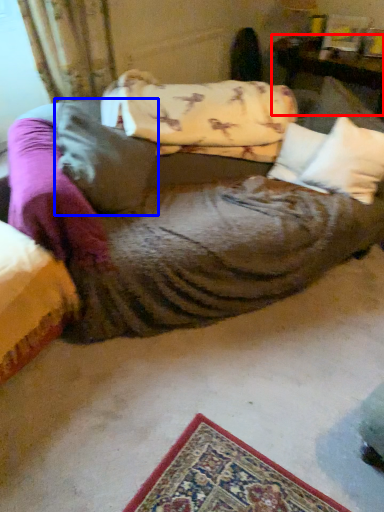
Question: Which object appears farthest to the camera in this image, furniture (highlighted by a red box) or pillow (highlighted by a blue box)?

Choices:
 (A) furniture
 (B) pillow

Answer: (A)